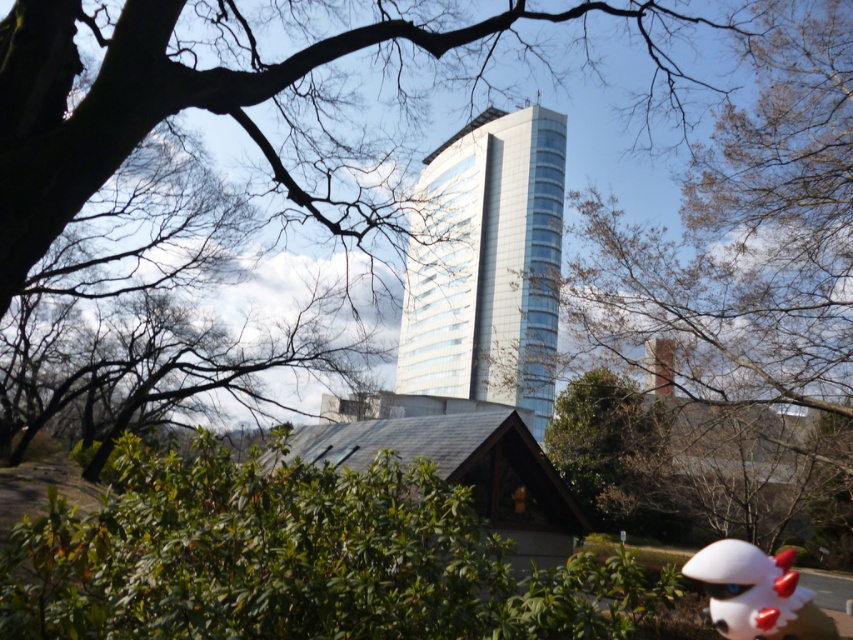
Consider the image. You are an artist planning to paint this scene. You want to ensure the proportions between the bare branches at upper center and the white matte plush toy at lower right are accurate. Which object should you draw larger in your painting?

The bare branches at upper center should be drawn larger than the white matte plush toy at lower right because the description states that the bare branches at upper center has a larger size compared to white matte plush toy at lower right.

Consider the image. Where is the bare branches at upper center located in the image?

The bare branches at upper center are located at point (747, 275).